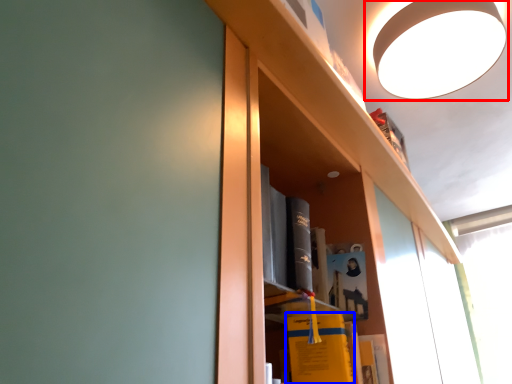
Question: Among these objects, which one is nearest to the camera, lamp (highlighted by a red box) or book (highlighted by a blue box)?

Choices:
 (A) lamp
 (B) book

Answer: (B)